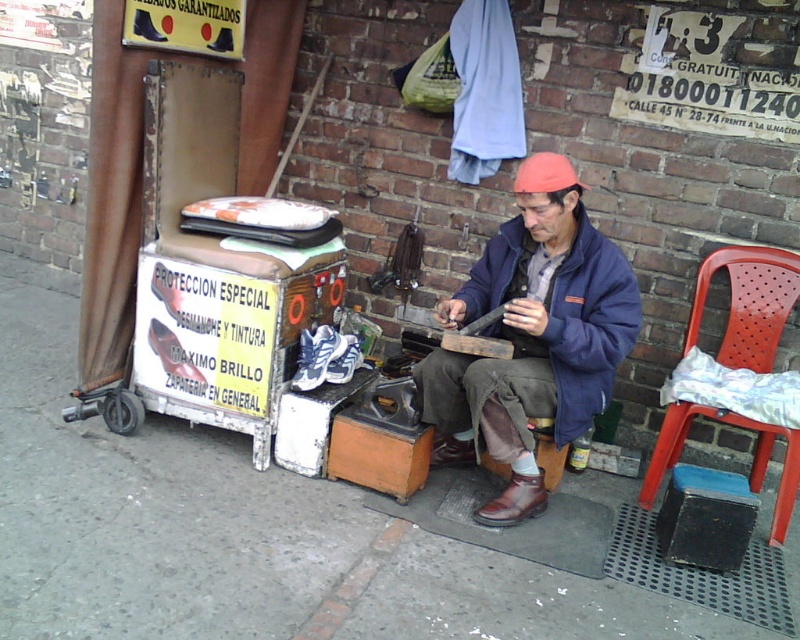
You are a customer waiting to get your shoes shined. You see the white leather shoe at center and the brown leather shoe at center. Which one is placed higher?

The white leather shoe at center is above the brown leather shoe at center.

You are a customer wanting to sit down for a shoe shine. The red plastic chair at right is the only available seating. Can you estimate its location relative to the shoe shine worker?

The red plastic chair at right is located at the coordinates point (748, 304) relative to the shoe shine worker.

You are a customer standing in front of the shoe shine service setup. You notice two points marked on the image. The first point is at coordinates point (x=502, y=257) and the second is at point (x=444, y=438). From your perspective, which point appears closer to you?

Point (x=502, y=257) is closer to the camera than point (x=444, y=438), so from your perspective, the first point appears closer to you.